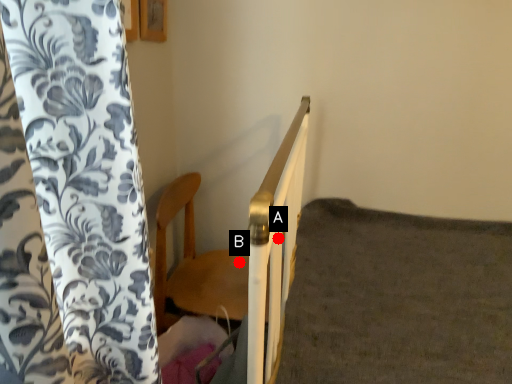
Question: Two points are circled on the image, labeled by A and B beside each circle. Which point is closer to the camera?

Choices:
 (A) A is closer
 (B) B is closer

Answer: (A)